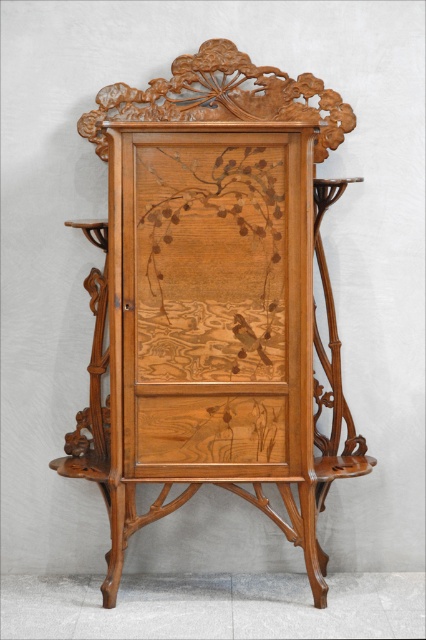
Question: Is natural wood cabinet at center closer to the viewer compared to natural wood drawer at center?

Choices:
 (A) no
 (B) yes

Answer: (B)

Question: Which point is farther from the camera taking this photo?

Choices:
 (A) (261, 452)
 (B) (184, 340)

Answer: (A)

Question: Where is natural wood cabinet at center located in relation to natural wood drawer at center in the image?

Choices:
 (A) above
 (B) below

Answer: (A)

Question: Is natural wood cabinet at center further to camera compared to natural wood drawer at center?

Choices:
 (A) yes
 (B) no

Answer: (B)

Question: Which of the following is the farthest from the observer?

Choices:
 (A) (276, 218)
 (B) (152, 413)

Answer: (B)